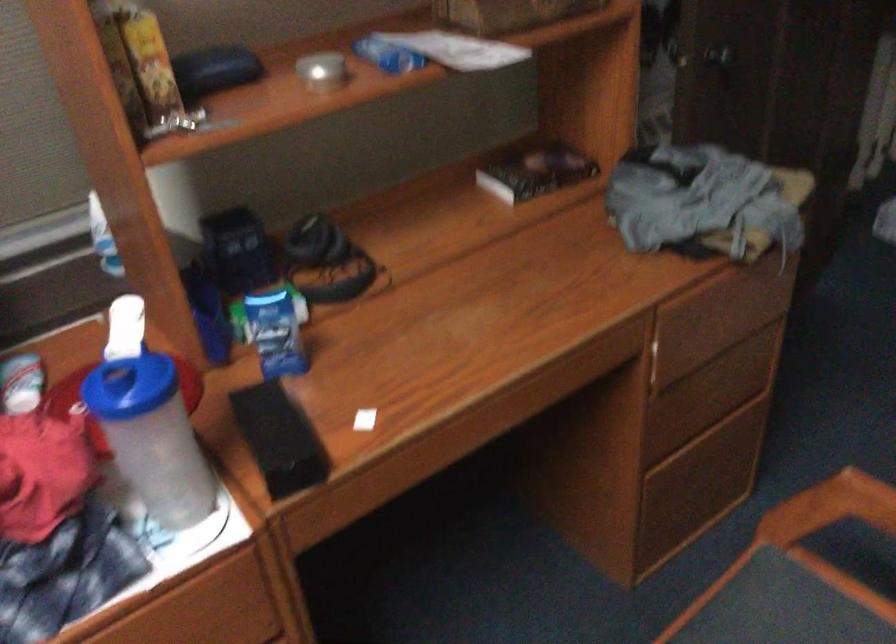
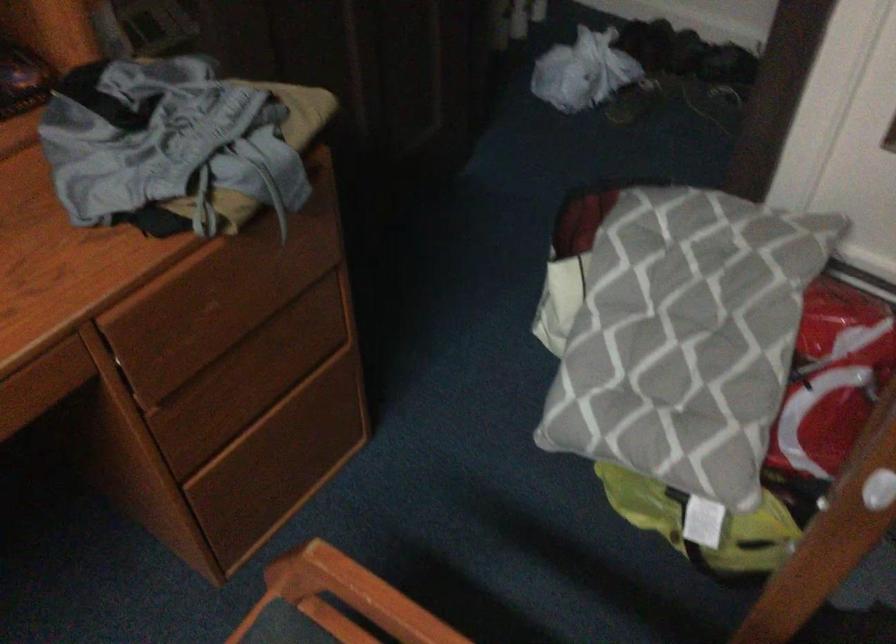
Question: The camera is either moving clockwise (left) or counter-clockwise (right) around the object. The first image is from the beginning of the video and the second image is from the end. Is the camera moving left or right when shooting the video?

Choices:
 (A) Left
 (B) Right

Answer: (A)